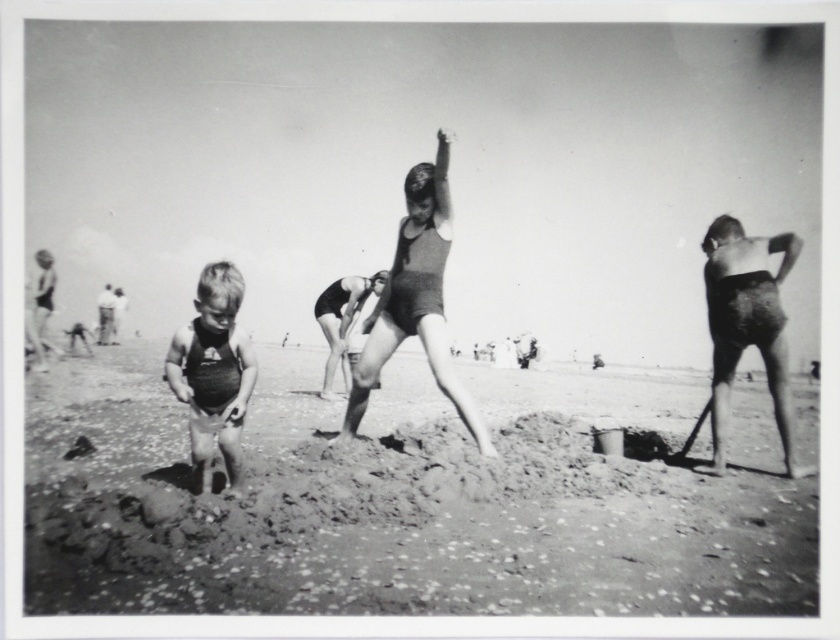
Between smooth sand at center and dark swimsuit at center, which one has more height?

dark swimsuit at center

Is smooth sand at center smaller than dark swimsuit at center?

No.

Is point (655, 605) farther from camera compared to point (455, 380)?

No, it is in front of (455, 380).

You are a GUI agent. You are given a task and a screenshot of the screen. Output one action in this format:
    pyautogui.click(x=<x>, y=<y>)
    Task: Click on the smooth sand at center
    
    Given the screenshot: What is the action you would take?
    pyautogui.click(x=408, y=499)

Between dark swimsuit at center and matte swimsuit at left, which one has more height?

dark swimsuit at center is taller.

Does dark swimsuit at center have a lesser height compared to matte swimsuit at left?

Incorrect, dark swimsuit at center's height does not fall short of matte swimsuit at left's.

This screenshot has height=640, width=840. What do you see at coordinates (416, 300) in the screenshot?
I see `dark swimsuit at center` at bounding box center [416, 300].

Locate an element on the screen. Image resolution: width=840 pixels, height=640 pixels. dark swimsuit at center is located at coordinates (416, 300).

Is point (290, 365) positioned before point (227, 358)?

No, it is behind (227, 358).

Which of these two, smooth sand at center or matte swimsuit at left, stands shorter?

Standing shorter between the two is smooth sand at center.

The width and height of the screenshot is (840, 640). Find the location of `smooth sand at center`. smooth sand at center is located at coordinates (408, 499).